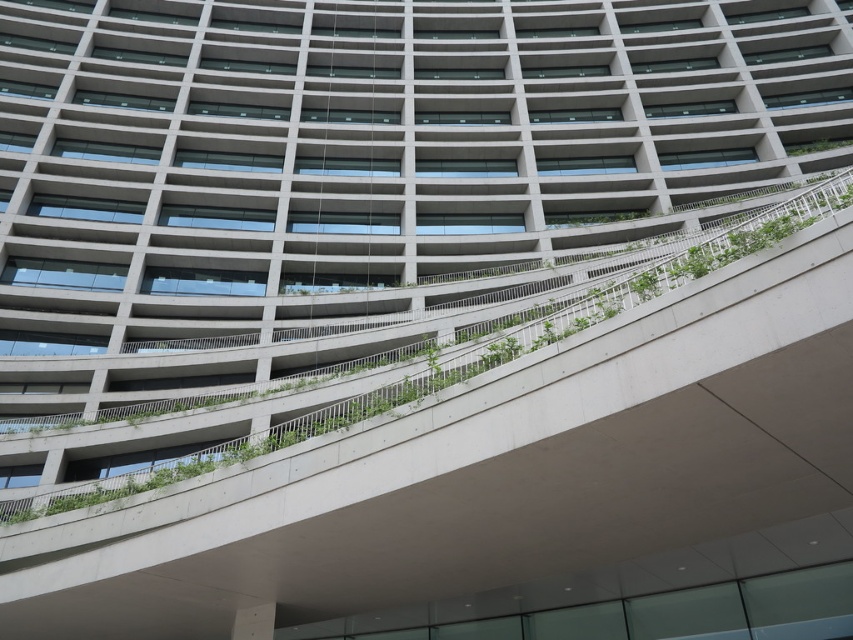
Question: Where is green leafy plant at center located in relation to green leafy plant at upper right in the image?

Choices:
 (A) left
 (B) right

Answer: (A)

Question: Which object appears closest to the camera in this image?

Choices:
 (A) green leafy plant at center
 (B) green leafy plant at upper right

Answer: (A)

Question: Where is green leafy plant at center located in relation to green leafy plant at upper right in the image?

Choices:
 (A) right
 (B) left

Answer: (B)

Question: Which point is closer to the camera taking this photo?

Choices:
 (A) (785, 152)
 (B) (364, 413)

Answer: (B)

Question: Which object appears farthest from the camera in this image?

Choices:
 (A) green leafy plant at upper right
 (B) green leafy plant at center

Answer: (A)

Question: Is green leafy plant at center closer to the viewer compared to green leafy plant at upper right?

Choices:
 (A) no
 (B) yes

Answer: (B)